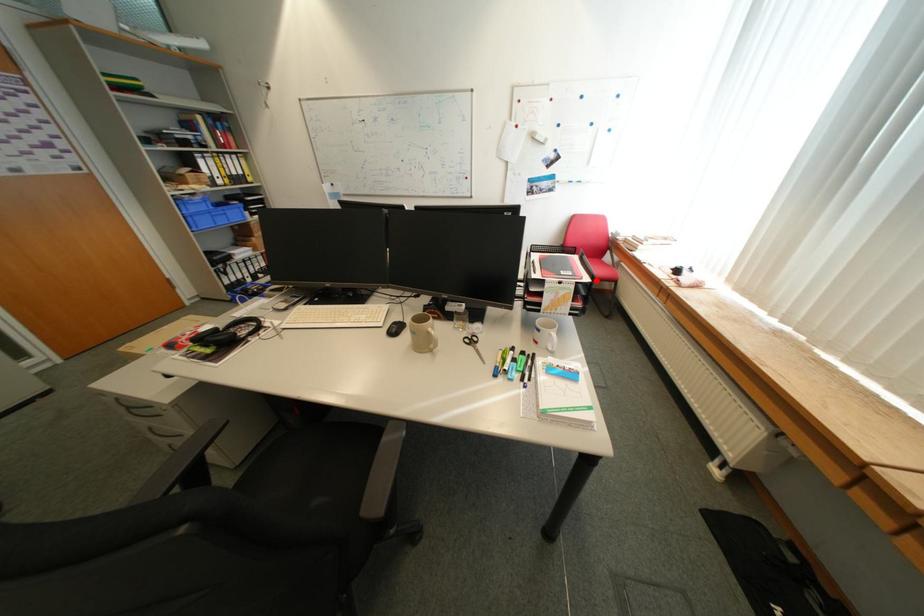
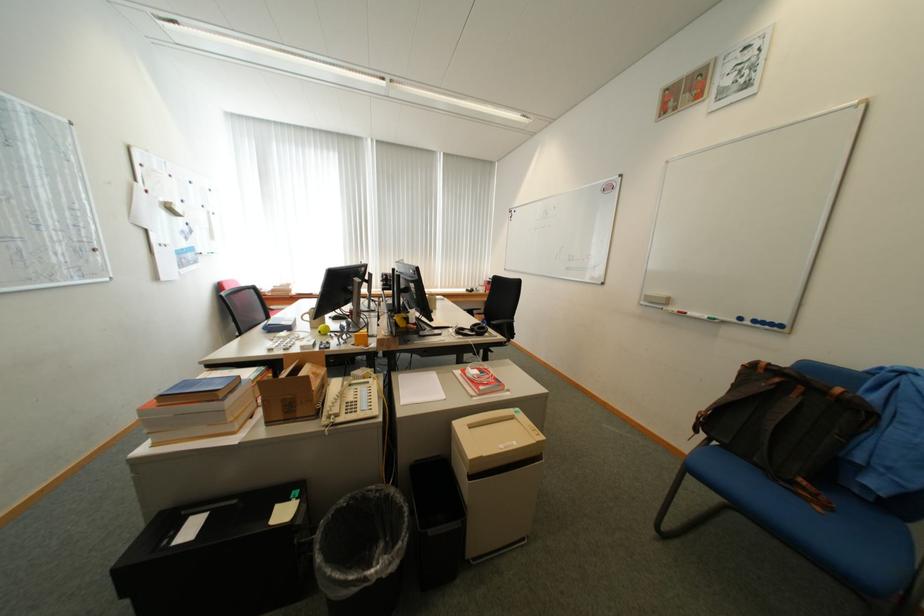
Question: I am providing you with two images of the same scene from different viewpoints. A red point is marked on the first image. Can you still see the location of the red point in image 2?

Choices:
 (A) Yes
 (B) No

Answer: (B)